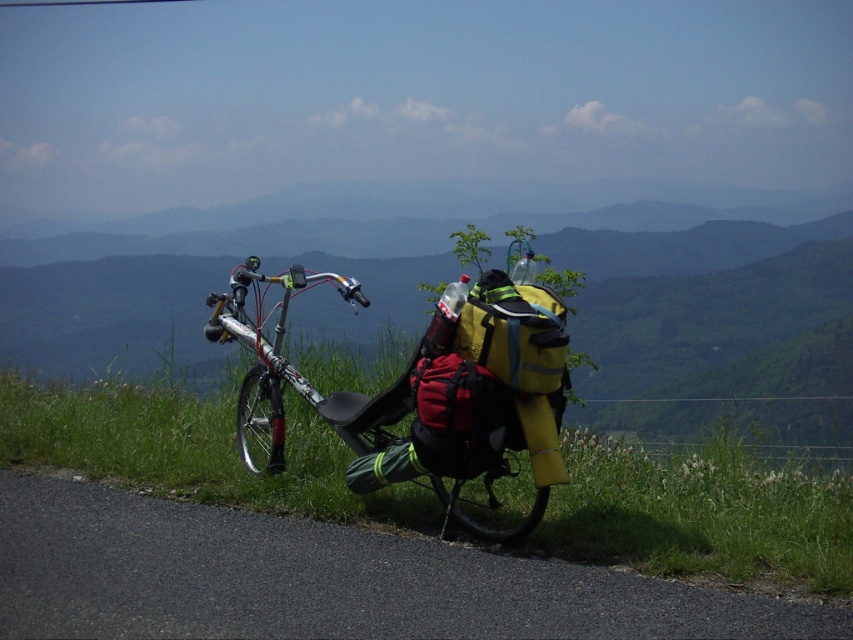
Question: Where is black asphalt road at lower left located in relation to silver metallic bicycle at center in the image?

Choices:
 (A) above
 (B) below

Answer: (B)

Question: Is green grass at lower left smaller than silver metallic bicycle at center?

Choices:
 (A) no
 (B) yes

Answer: (B)

Question: Which object is farther from the camera taking this photo?

Choices:
 (A) green grass at lower left
 (B) silver metallic bicycle at center

Answer: (A)

Question: Among these points, which one is farthest from the camera?

Choices:
 (A) (459, 330)
 (B) (428, 611)

Answer: (A)

Question: Does black asphalt road at lower left have a smaller size compared to green grass at lower left?

Choices:
 (A) yes
 (B) no

Answer: (B)

Question: Which point is closer to the camera taking this photo?

Choices:
 (A) (532, 518)
 (B) (184, 456)

Answer: (A)